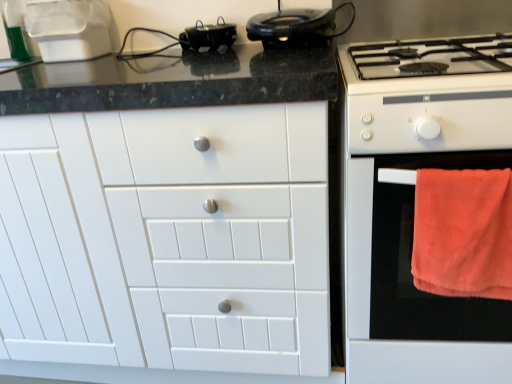
Question: Considering the positions of white glossy gas stove at right and white matte cabinet at center in the image, is white glossy gas stove at right taller or shorter than white matte cabinet at center?

Choices:
 (A) short
 (B) tall

Answer: (A)

Question: Looking at the image, does white glossy gas stove at right seem bigger or smaller compared to white matte cabinet at center?

Choices:
 (A) big
 (B) small

Answer: (B)

Question: Estimate the real-world distances between objects in this image. Which object is closer to the black glossy pot at upper center?

Choices:
 (A) orange towel at right
 (B) white glossy gas stove at right
 (C) shiny black steering wheel at upper center
 (D) orange soft towel at right
 (E) white matte cabinet at center

Answer: (C)

Question: Which object is the closest to the shiny black steering wheel at upper center?

Choices:
 (A) orange towel at right
 (B) orange soft towel at right
 (C) white glossy gas stove at right
 (D) white matte cabinet at center
 (E) black glossy pot at upper center

Answer: (E)